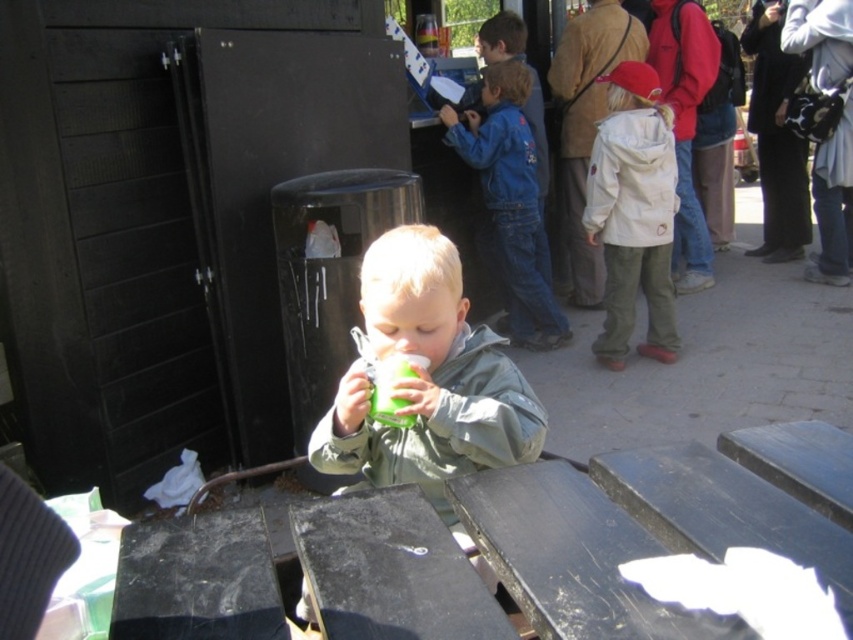
Looking at this image, you are a photographer taking a picture of the scene. You want to focus on the green matte cup at center and the blue denim jacket at center. Which object is positioned closer to the camera?

The green matte cup at center is closer to the viewer than the blue denim jacket at center, so it will appear closer to the camera.

You are a tailor measuring jackets for a fitting session. You have two jackets in front of you, the white matte jacket at right and the blue denim jacket at center. The customer wants to know which jacket is closer to the other. Please state the distance between them.

The white matte jacket at right is 21.17 inches away from the blue denim jacket at center.